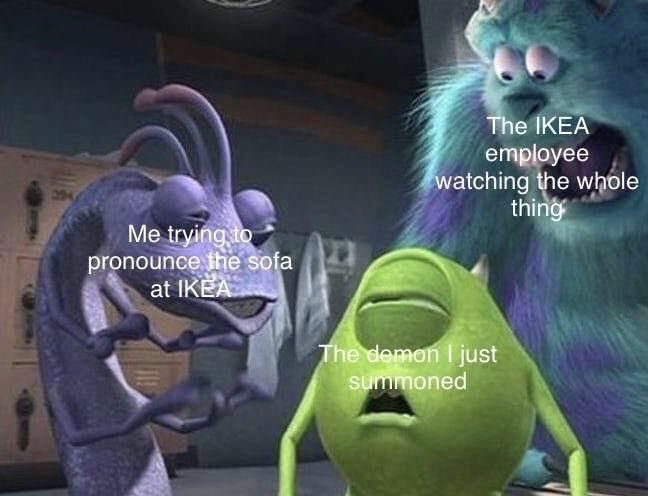
I want to click on towel, so click(316, 276), click(273, 346).